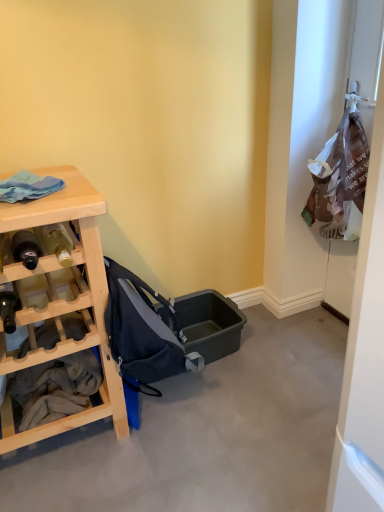
Question: Is matte black bottle at left, which ranks as the 2th bottle in top-to-bottom order, at the left side of matte glass bottle at left, marked as the third bottle in a bottom-to-top arrangement?

Choices:
 (A) no
 (B) yes

Answer: (B)

Question: Can you confirm if matte black bottle at left, which ranks as the 2th bottle in top-to-bottom order, is wider than matte glass bottle at left, which ranks as the first bottle in top-to-bottom order?

Choices:
 (A) yes
 (B) no

Answer: (A)

Question: Is matte black bottle at left, which is the second bottle in bottom-to-top order, bigger than matte glass bottle at left, which ranks as the first bottle in top-to-bottom order?

Choices:
 (A) no
 (B) yes

Answer: (B)

Question: Are matte black bottle at left, which is the second bottle in bottom-to-top order, and matte glass bottle at left, which ranks as the first bottle in top-to-bottom order, far apart?

Choices:
 (A) yes
 (B) no

Answer: (B)

Question: Is matte black bottle at left, which ranks as the 2th bottle in top-to-bottom order, directly adjacent to matte glass bottle at left, marked as the third bottle in a bottom-to-top arrangement?

Choices:
 (A) no
 (B) yes

Answer: (B)

Question: From a real-world perspective, relative to white cotton towels at left, is matte black bottle at left, the 1th bottle ordered from the bottom, vertically above or below?

Choices:
 (A) below
 (B) above

Answer: (B)

Question: Looking at the image, does matte black bottle at left, the 1th bottle ordered from the bottom, seem bigger or smaller compared to white cotton towels at left?

Choices:
 (A) big
 (B) small

Answer: (B)

Question: In terms of width, does matte black bottle at left, the 1th bottle ordered from the bottom, look wider or thinner when compared to white cotton towels at left?

Choices:
 (A) wide
 (B) thin

Answer: (B)

Question: Based on their positions, is matte black bottle at left, the 1th bottle ordered from the bottom, located to the left or right of white cotton towels at left?

Choices:
 (A) left
 (B) right

Answer: (A)

Question: In the image, is natural wood desk at left on the left side or the right side of dark blue fabric baby carriage at center?

Choices:
 (A) left
 (B) right

Answer: (A)

Question: Is natural wood desk at left situated inside dark blue fabric baby carriage at center or outside?

Choices:
 (A) outside
 (B) inside

Answer: (A)

Question: Looking at the image, does natural wood desk at left seem bigger or smaller compared to dark blue fabric baby carriage at center?

Choices:
 (A) small
 (B) big

Answer: (B)

Question: From a real-world perspective, relative to dark blue fabric baby carriage at center, is natural wood desk at left vertically above or below?

Choices:
 (A) above
 (B) below

Answer: (B)

Question: From a real-world perspective, is white paper bag at right above or below dark blue fabric baby carriage at center?

Choices:
 (A) below
 (B) above

Answer: (B)

Question: Does point (339, 438) appear closer or farther from the camera than point (147, 364)?

Choices:
 (A) farther
 (B) closer

Answer: (B)